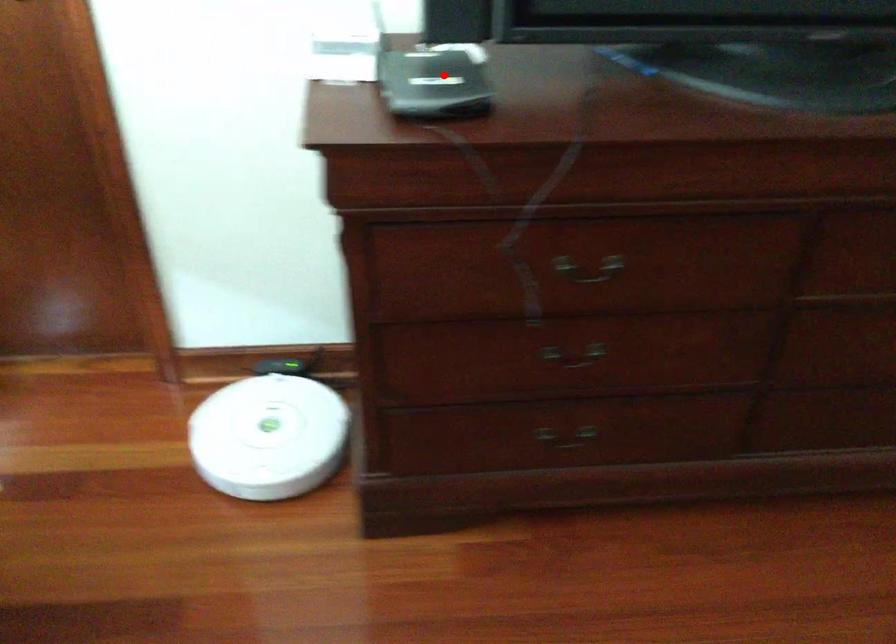
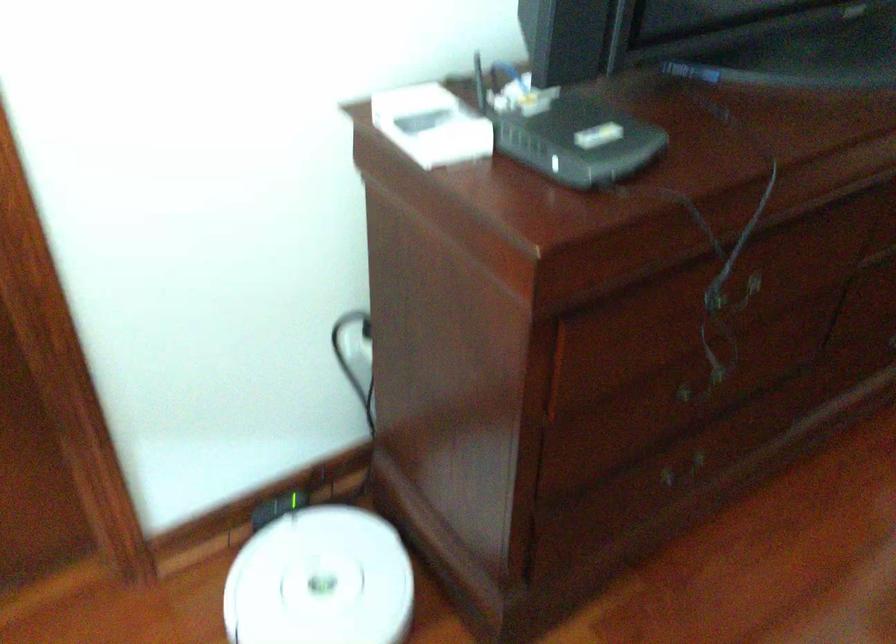
Where in the second image is the point corresponding to the highlighted location from the first image?

(569, 134)